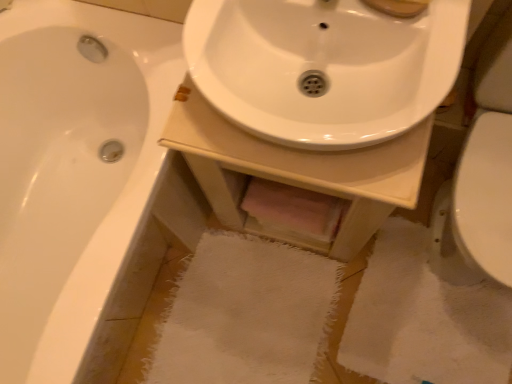
Question: Is white glossy sink at center to the left of white glossy sink at center from the viewer's perspective?

Choices:
 (A) no
 (B) yes

Answer: (B)

Question: Is white glossy sink at center shorter than white glossy sink at center?

Choices:
 (A) yes
 (B) no

Answer: (A)

Question: From a real-world perspective, is white glossy sink at center below white glossy sink at center?

Choices:
 (A) no
 (B) yes

Answer: (A)

Question: Considering the relative sizes of white glossy sink at center and white glossy sink at center in the image provided, is white glossy sink at center wider than white glossy sink at center?

Choices:
 (A) yes
 (B) no

Answer: (B)

Question: Is white glossy sink at center not within white glossy sink at center?

Choices:
 (A) no
 (B) yes

Answer: (B)

Question: Considering the positions of white glossy bathtub at left and white glossy sink at center in the image, is white glossy bathtub at left taller or shorter than white glossy sink at center?

Choices:
 (A) tall
 (B) short

Answer: (A)

Question: Considering their positions, is white glossy bathtub at left located in front of or behind white glossy sink at center?

Choices:
 (A) behind
 (B) front

Answer: (A)

Question: From the image's perspective, is white glossy bathtub at left positioned above or below white glossy sink at center?

Choices:
 (A) below
 (B) above

Answer: (A)

Question: In terms of width, does white glossy bathtub at left look wider or thinner when compared to white glossy sink at center?

Choices:
 (A) wide
 (B) thin

Answer: (A)

Question: Is white glossy sink at center inside or outside of white glossy sink at center?

Choices:
 (A) inside
 (B) outside

Answer: (B)

Question: From the image's perspective, is white glossy sink at center positioned above or below white glossy sink at center?

Choices:
 (A) above
 (B) below

Answer: (B)

Question: From their relative heights in the image, would you say white glossy sink at center is taller or shorter than white glossy sink at center?

Choices:
 (A) tall
 (B) short

Answer: (A)

Question: From a real-world perspective, is white glossy sink at center positioned above or below white glossy sink at center?

Choices:
 (A) below
 (B) above

Answer: (A)

Question: Is white glossy bathtub at left wider or thinner than white glossy sink at center?

Choices:
 (A) wide
 (B) thin

Answer: (A)

Question: From their relative heights in the image, would you say white glossy bathtub at left is taller or shorter than white glossy sink at center?

Choices:
 (A) short
 (B) tall

Answer: (A)